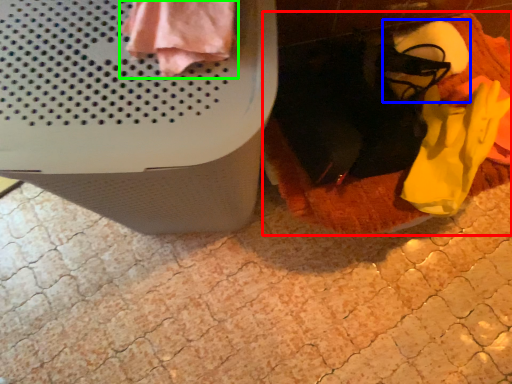
Question: Which is farther away from blanket (highlighted by a red box)? footwear (highlighted by a blue box) or clothing (highlighted by a green box)?

Choices:
 (A) footwear
 (B) clothing

Answer: (B)